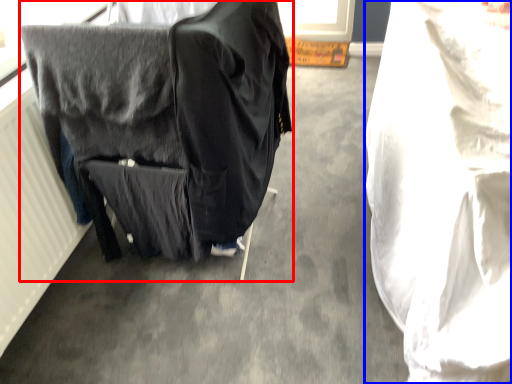
Question: Among these objects, which one is farthest to the camera, furniture (highlighted by a red box) or sheet (highlighted by a blue box)?

Choices:
 (A) furniture
 (B) sheet

Answer: (A)